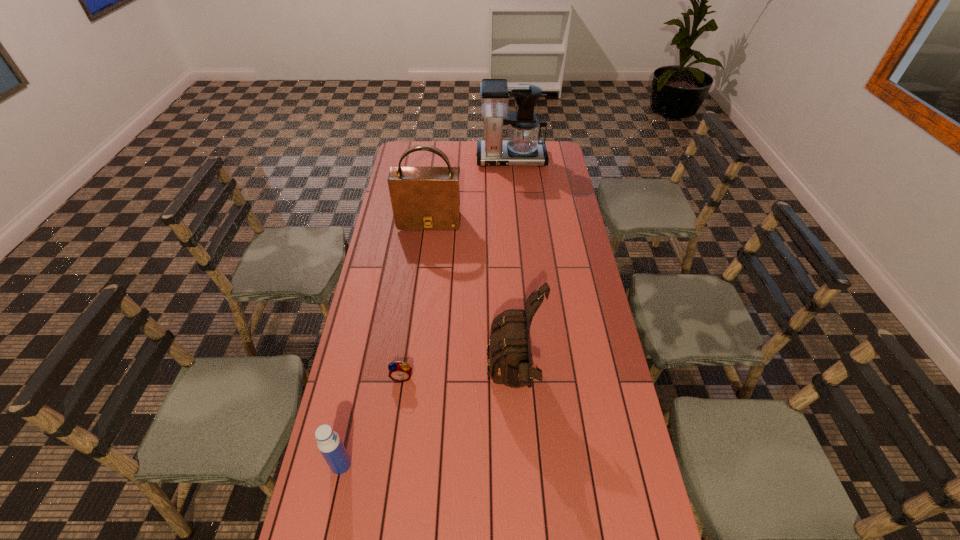
Image resolution: width=960 pixels, height=540 pixels. What are the coordinates of `the farthest object` in the screenshot? It's located at (523, 148).

Where is `the fourth nearest object`? This screenshot has width=960, height=540. the fourth nearest object is located at coordinates (423, 197).

Locate an element on the screen. The width and height of the screenshot is (960, 540). the farther shoulder bag is located at coordinates (423, 197).

The height and width of the screenshot is (540, 960). I want to click on the nearer shoulder bag, so pos(510,362).

This screenshot has height=540, width=960. In order to click on the fourth tallest object in this screenshot , I will do `click(329, 443)`.

Identify the location of the nearest object. The width and height of the screenshot is (960, 540). (329, 443).

Find the location of a particular element. alarm clock is located at coordinates (401, 371).

You are a GUI agent. You are given a task and a screenshot of the screen. Output one action in this format:
    pyautogui.click(x=<x>, y=<y>)
    Task: Click on the free space located 0.380m at the front of the farthest object where the controls are located
    This screenshot has width=960, height=540.
    Given the screenshot: What is the action you would take?
    pyautogui.click(x=516, y=218)

I want to click on vacant region located on the front flap of the fourth nearest object, so click(425, 253).

I want to click on vacant space located on the front-facing side of the nearer shoulder bag, so click(428, 382).